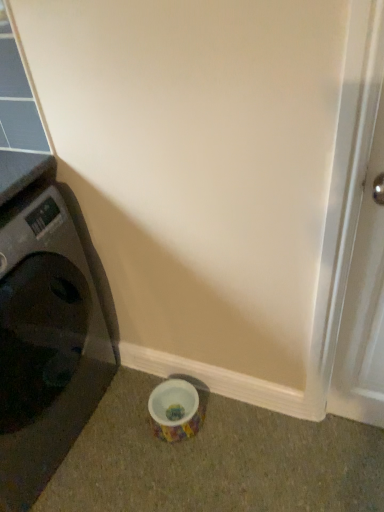
Question: From a real-world perspective, relative to black plastic washing machine at left, is white glossy screen door at right vertically above or below?

Choices:
 (A) above
 (B) below

Answer: (A)

Question: From the image's perspective, is white glossy screen door at right positioned above or below black plastic washing machine at left?

Choices:
 (A) below
 (B) above

Answer: (B)

Question: From their relative heights in the image, would you say white glossy screen door at right is taller or shorter than black plastic washing machine at left?

Choices:
 (A) tall
 (B) short

Answer: (A)

Question: Is black plastic washing machine at left taller or shorter than white glossy screen door at right?

Choices:
 (A) tall
 (B) short

Answer: (B)

Question: From a real-world perspective, is black plastic washing machine at left positioned above or below white glossy screen door at right?

Choices:
 (A) below
 (B) above

Answer: (A)

Question: In terms of size, does black plastic washing machine at left appear bigger or smaller than white glossy screen door at right?

Choices:
 (A) big
 (B) small

Answer: (A)

Question: From the image's perspective, is black plastic washing machine at left positioned above or below white glossy screen door at right?

Choices:
 (A) above
 (B) below

Answer: (B)